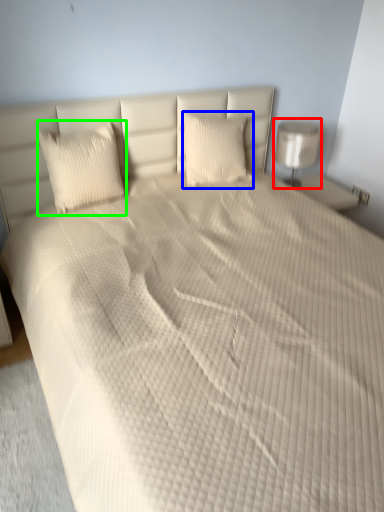
Question: Based on their relative distances, which object is farther from lamp (highlighted by a red box)? Choose from pillow (highlighted by a blue box) and pillow (highlighted by a green box).

Choices:
 (A) pillow
 (B) pillow

Answer: (B)